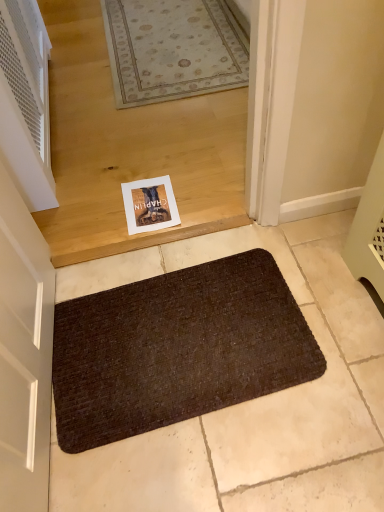
The width and height of the screenshot is (384, 512). In order to click on white perforated vent at left in this screenshot , I will do coord(26,102).

What do you see at coordinates (26, 102) in the screenshot?
I see `white perforated vent at left` at bounding box center [26, 102].

Describe the element at coordinates (176, 349) in the screenshot. I see `brown textured bath mat at lower center` at that location.

The width and height of the screenshot is (384, 512). I want to click on brown textured bath mat at lower center, so click(x=176, y=349).

Identify the location of white perforated vent at left. (26, 102).

Between brown textured bath mat at lower center and white perforated vent at left, which one appears on the right side from the viewer's perspective?

From the viewer's perspective, brown textured bath mat at lower center appears more on the right side.

Which is behind, brown textured bath mat at lower center or white perforated vent at left?

white perforated vent at left is further from the camera.

Does point (160, 366) lie behind point (36, 58)?

No.

From the image's perspective, is brown textured bath mat at lower center on top of white perforated vent at left?

No, from the image's perspective, brown textured bath mat at lower center is not on top of white perforated vent at left.

From a real-world perspective, is brown textured bath mat at lower center under white perforated vent at left?

Correct, in the physical world, brown textured bath mat at lower center is lower than white perforated vent at left.

Considering the sizes of brown textured bath mat at lower center and white perforated vent at left in the image, is brown textured bath mat at lower center wider or thinner than white perforated vent at left?

Clearly, brown textured bath mat at lower center has more width compared to white perforated vent at left.

Considering the relative sizes of brown textured bath mat at lower center and white perforated vent at left in the image provided, is brown textured bath mat at lower center shorter than white perforated vent at left?

Yes, brown textured bath mat at lower center is shorter than white perforated vent at left.

Can you confirm if brown textured bath mat at lower center is smaller than white perforated vent at left?

Yes.

Would you say white perforated vent at left is part of brown textured bath mat at lower center's contents?

That's incorrect, white perforated vent at left is not inside brown textured bath mat at lower center.

Can you see brown textured bath mat at lower center touching white perforated vent at left?

No, brown textured bath mat at lower center is not next to white perforated vent at left.

In the scene shown: Is brown textured bath mat at lower center oriented towards white perforated vent at left?

No.

How different are the orientations of brown textured bath mat at lower center and white perforated vent at left in degrees?

85.6 degrees separate the facing orientations of brown textured bath mat at lower center and white perforated vent at left.

Locate an element on the screen. Image resolution: width=384 pixels, height=512 pixels. air conditioner that is behind the brown textured bath mat at lower center is located at coordinates (26, 102).

Which is more to the left, white perforated vent at left or brown textured bath mat at lower center?

Positioned to the left is white perforated vent at left.

Is white perforated vent at left behind brown textured bath mat at lower center?

That is True.

Which point is more distant from viewer, (x=35, y=113) or (x=301, y=383)?

The point (x=35, y=113) is farther from the camera.

From the image's perspective, who appears lower, white perforated vent at left or brown textured bath mat at lower center?

brown textured bath mat at lower center appears lower in the image.

From a real-world perspective, is white perforated vent at left under brown textured bath mat at lower center?

Actually, white perforated vent at left is physically above brown textured bath mat at lower center in the real world.

Which of these two, white perforated vent at left or brown textured bath mat at lower center, is thinner?

white perforated vent at left is thinner.

Can you confirm if white perforated vent at left is taller than brown textured bath mat at lower center?

Yes, white perforated vent at left is taller than brown textured bath mat at lower center.

Considering the sizes of objects white perforated vent at left and brown textured bath mat at lower center in the image provided, who is bigger, white perforated vent at left or brown textured bath mat at lower center?

white perforated vent at left is bigger.

Could brown textured bath mat at lower center be considered to be inside white perforated vent at left?

No, brown textured bath mat at lower center is not a part of white perforated vent at left.

Would you consider white perforated vent at left to be distant from brown textured bath mat at lower center?

No, there isn't a large distance between white perforated vent at left and brown textured bath mat at lower center.

Is white perforated vent at left facing towards brown textured bath mat at lower center?

No, white perforated vent at left is not turned towards brown textured bath mat at lower center.

This screenshot has width=384, height=512. I want to click on bath mat in front of the white perforated vent at left, so click(x=176, y=349).

The image size is (384, 512). I want to click on bath mat in front of the white perforated vent at left, so click(176, 349).

The width and height of the screenshot is (384, 512). Find the location of `air conditioner on the left of brown textured bath mat at lower center`. air conditioner on the left of brown textured bath mat at lower center is located at coordinates (26, 102).